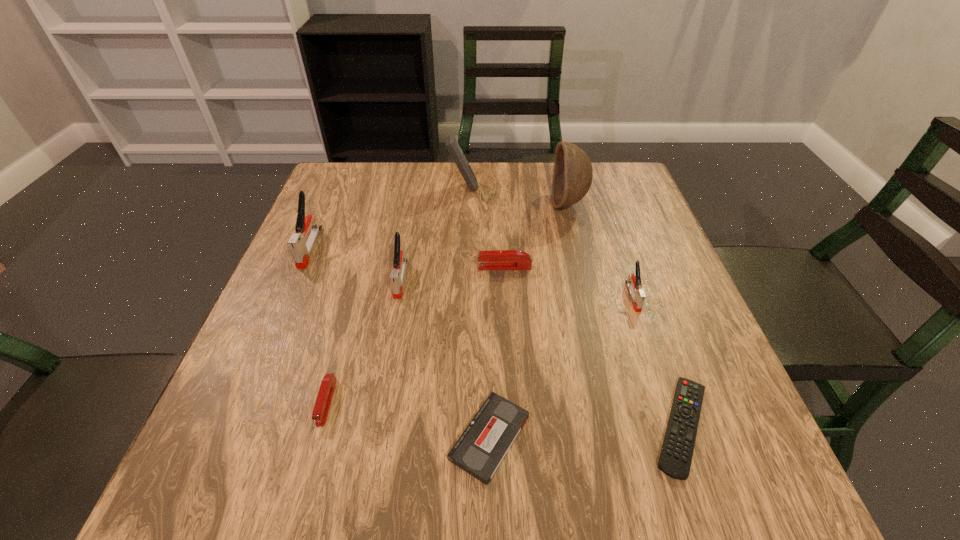
I want to click on free region that satisfies the following two spatial constraints: 1. on the handle side of the videotape; 2. on the right side of the fourth shortest stapler, so click(x=372, y=437).

Locate an element on the screen. The height and width of the screenshot is (540, 960). blank area in the image that satisfies the following two spatial constraints: 1. on the front-facing side of the right red stapler; 2. on the handle side of the sixth shortest object is located at coordinates (505, 279).

Where is `vacant space that satisfies the following two spatial constraints: 1. on the handle side of the shortest object; 2. on the left side of the third tallest object`? vacant space that satisfies the following two spatial constraints: 1. on the handle side of the shortest object; 2. on the left side of the third tallest object is located at coordinates (234, 426).